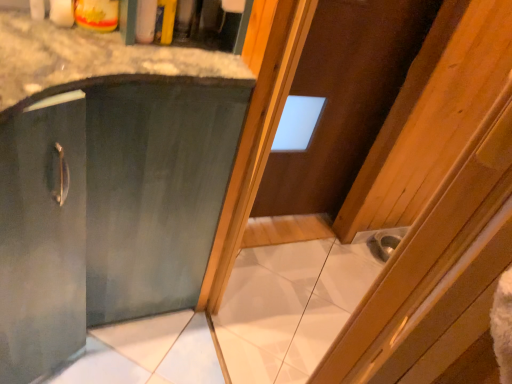
Question: Is metallic silver sink at lower right in front of brown wooden door at upper center?

Choices:
 (A) no
 (B) yes

Answer: (A)

Question: Does metallic silver sink at lower right have a larger size compared to brown wooden door at upper center?

Choices:
 (A) no
 (B) yes

Answer: (A)

Question: From the image's perspective, is metallic silver sink at lower right on top of brown wooden door at upper center?

Choices:
 (A) no
 (B) yes

Answer: (A)

Question: Is metallic silver sink at lower right outside brown wooden door at upper center?

Choices:
 (A) no
 (B) yes

Answer: (B)

Question: Considering the relative positions of metallic silver sink at lower right and brown wooden door at upper center in the image provided, is metallic silver sink at lower right to the left of brown wooden door at upper center from the viewer's perspective?

Choices:
 (A) no
 (B) yes

Answer: (A)

Question: In terms of height, does metallic silver sink at lower right look taller or shorter compared to brown wooden door at upper center?

Choices:
 (A) tall
 (B) short

Answer: (B)

Question: Considering the positions of metallic silver sink at lower right and brown wooden door at upper center in the image, is metallic silver sink at lower right wider or thinner than brown wooden door at upper center?

Choices:
 (A) wide
 (B) thin

Answer: (A)

Question: Is metallic silver sink at lower right bigger or smaller than brown wooden door at upper center?

Choices:
 (A) small
 (B) big

Answer: (A)

Question: From a real-world perspective, relative to brown wooden door at upper center, is metallic silver sink at lower right vertically above or below?

Choices:
 (A) below
 (B) above

Answer: (A)

Question: In the image, is brown wooden door at upper center positioned in front of or behind metallic silver sink at lower right?

Choices:
 (A) behind
 (B) front

Answer: (B)

Question: Does point (262, 210) appear closer or farther from the camera than point (380, 253)?

Choices:
 (A) closer
 (B) farther

Answer: (A)

Question: Is brown wooden door at upper center situated inside metallic silver sink at lower right or outside?

Choices:
 (A) inside
 (B) outside

Answer: (B)

Question: From the image's perspective, is brown wooden door at upper center above or below metallic silver sink at lower right?

Choices:
 (A) below
 (B) above

Answer: (B)

Question: Is brown wooden door at upper center spatially inside matte green cabinet at center, or outside of it?

Choices:
 (A) inside
 (B) outside

Answer: (B)

Question: Considering the relative positions of brown wooden door at upper center and matte green cabinet at center in the image provided, is brown wooden door at upper center to the left or to the right of matte green cabinet at center?

Choices:
 (A) left
 (B) right

Answer: (B)